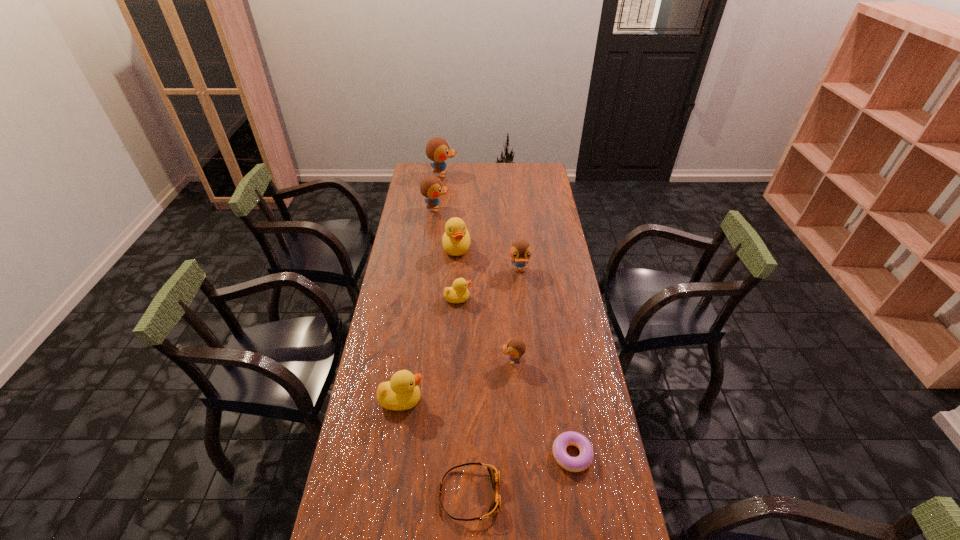
In order to click on free space located at the beak of the nearest yellow duck in this screenshot , I will do `click(509, 400)`.

The height and width of the screenshot is (540, 960). I want to click on free point located 0.180m on the front-facing side of the fourth nearest object, so click(448, 361).

The width and height of the screenshot is (960, 540). I want to click on vacant area situated on the front-facing side of the fourth nearest object, so click(x=419, y=361).

This screenshot has width=960, height=540. In order to click on free location located on the front-facing side of the fourth nearest object in this screenshot , I will do pyautogui.click(x=445, y=361).

Identify the location of vacant space located 0.110m at the beak of the fifth farthest object. (499, 299).

This screenshot has height=540, width=960. In order to click on free point located 0.120m with the lenses facing forward on the goggles in this screenshot , I will do `click(544, 494)`.

This screenshot has width=960, height=540. What are the coordinates of `vacant region located on the back of the doughnut` in the screenshot? It's located at (564, 403).

Locate an element on the screen. This screenshot has width=960, height=540. object situated at the far edge is located at coordinates (437, 149).

This screenshot has width=960, height=540. I want to click on object at the right edge, so click(580, 463).

At what (x,y) coordinates should I click in order to perform the action: click on object located at the far left corner. Please return your answer as a coordinate pair (x, y). The width and height of the screenshot is (960, 540). Looking at the image, I should click on (437, 149).